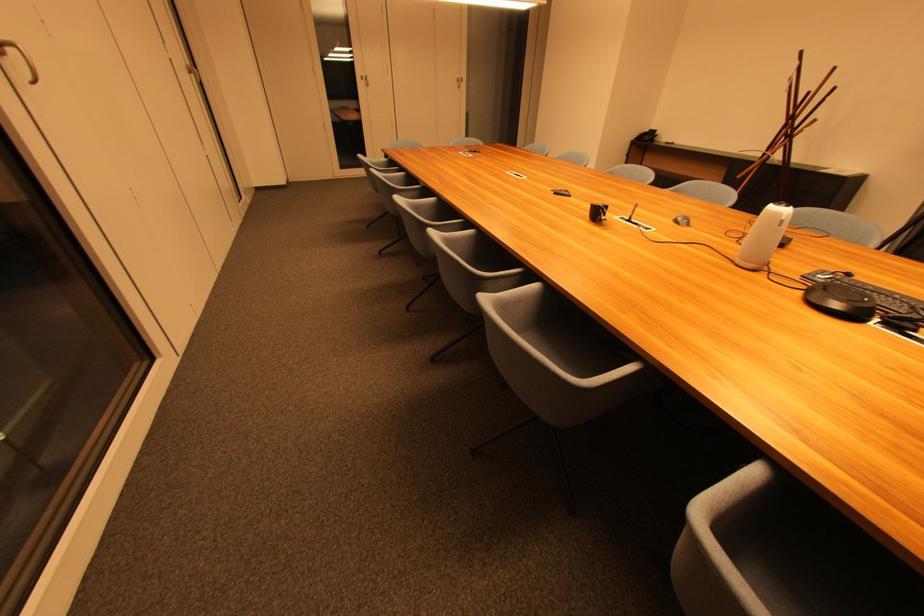
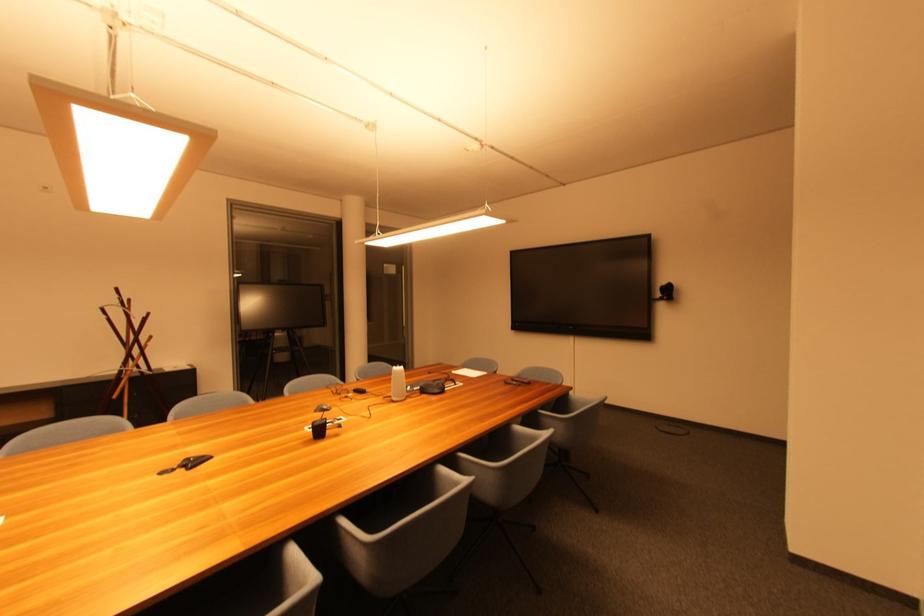
Question: I am providing you with two images of the same scene from different viewpoints. After the viewpoint changes to image2, which objects are now occluded?

Choices:
 (A) pair of eyeglasses
 (B) white cylindrical speaker
 (C) grey chair sitting surface
 (D) none of these

Answer: (D)